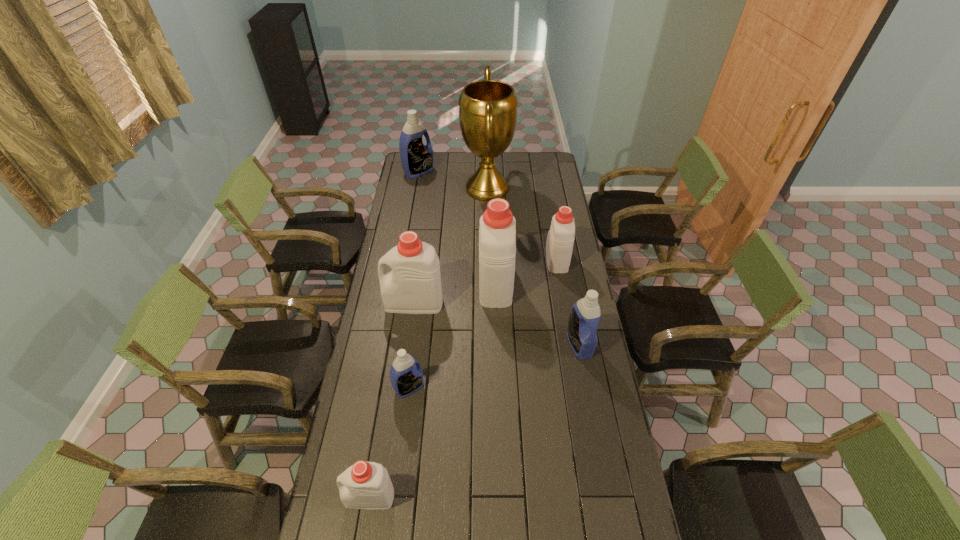
Locate an element on the screen. The width and height of the screenshot is (960, 540). free point that satisfies the following two spatial constraints: 1. on the handle side of the tallest detergent; 2. on the surface of the gold trophy cup with symbols is located at coordinates pos(492,188).

Identify the location of vacant region that satisfies the following two spatial constraints: 1. on the handle side of the rightmost white detergent; 2. on the surface of the trophy cup with symbols. (544, 188).

Identify the location of vacant space that satisfies the following two spatial constraints: 1. on the handle side of the third smallest white detergent; 2. on the back side of the rightmost blue detergent. (408, 345).